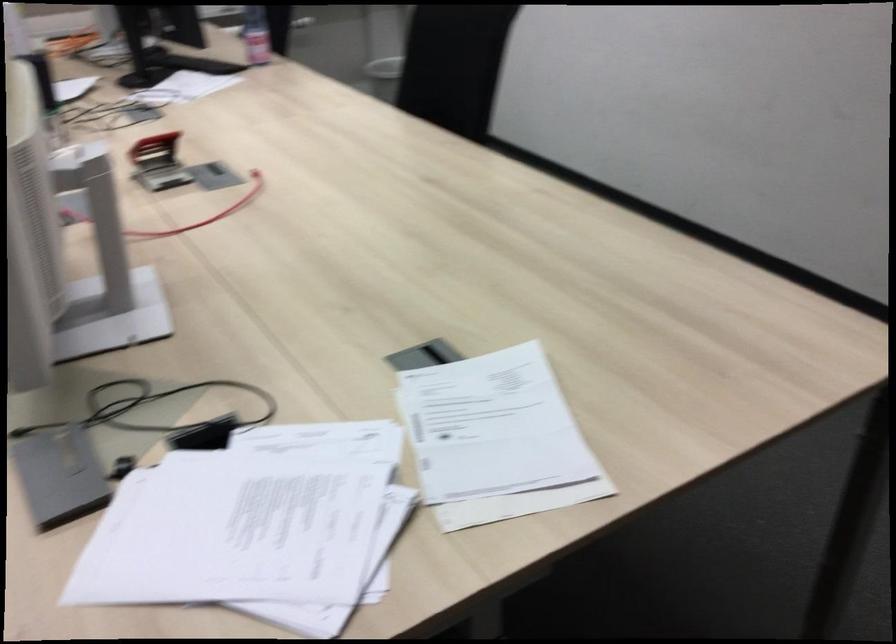
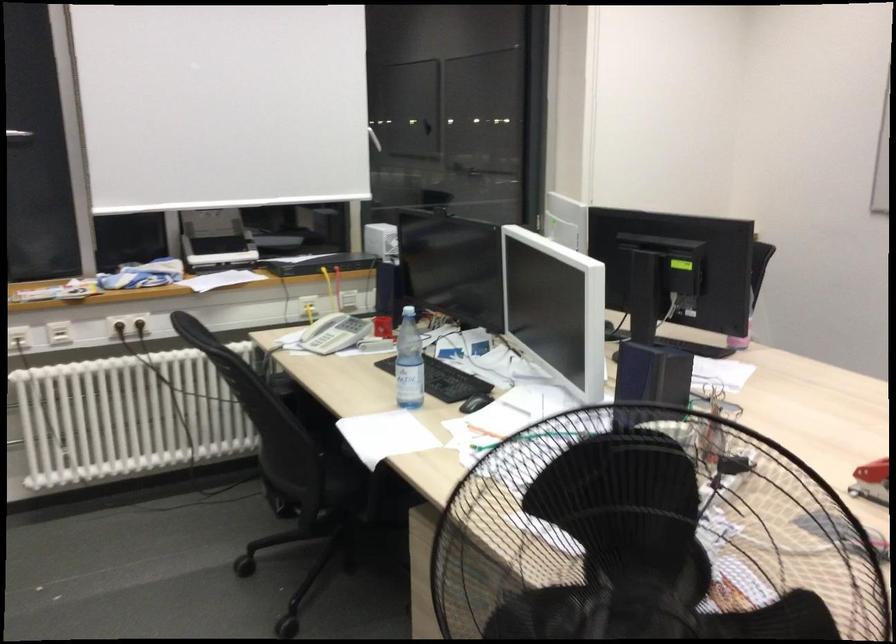
Question: In a continuous first-person perspective shot, in which direction is the camera moving?

Choices:
 (A) Left
 (B) Right
 (C) Forward
 (D) Backward

Answer: (A)